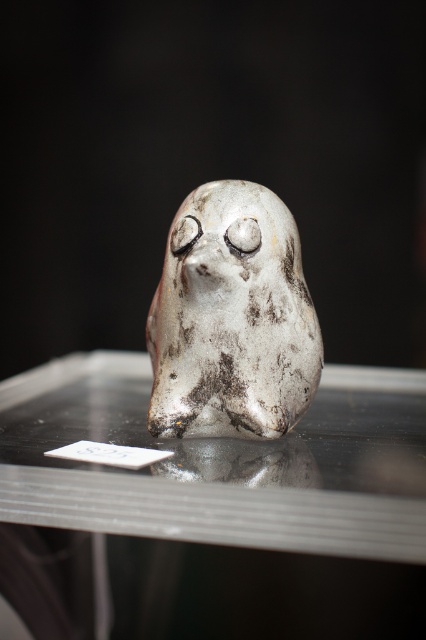
You are organizing a gallery exhibit and need to place a new sculpture on the transparent glass table at center. The existing point at coordinate point (x=215, y=480) is already marked on the table. Where should you place the new sculpture to ensure it aligns with the existing point?

The point (x=215, y=480) is on the transparent glass table at center, so you should place the new sculpture directly at the point (x=215, y=480) on the transparent glass table at center to align with it.

You are an art curator arranging an exhibition. You have a transparent glass table at center and a shiny metallic bird at center. Which object is located to the left of the other?

The transparent glass table at center is positioned on the left side of the shiny metallic bird at center.

You are a visitor at an art exhibition and see the transparent glass table at center and the shiny metallic bird at center. Which object is closer to the viewer?

The shiny metallic bird at center is closer to the viewer because it is positioned over the transparent glass table at center.